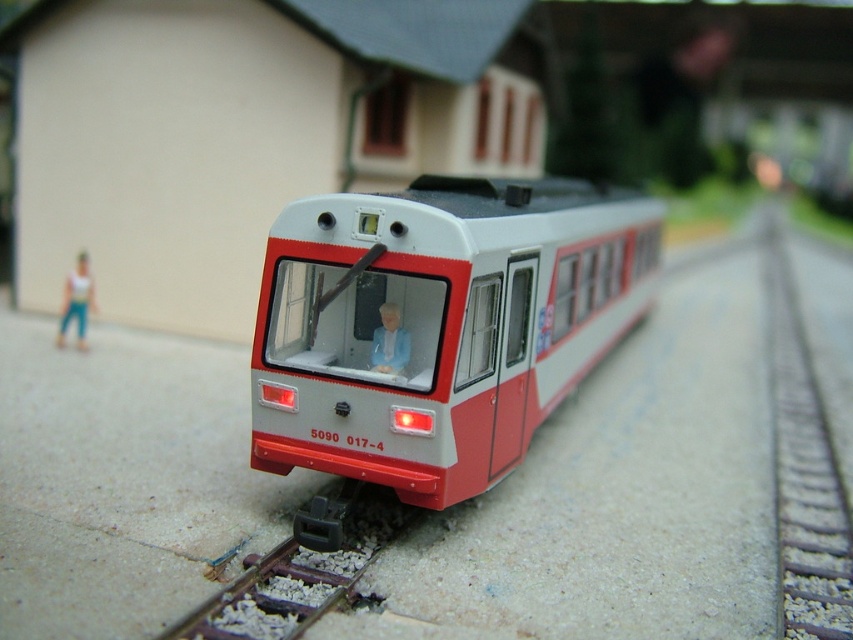
From the picture: Can you confirm if smooth metal train track at center is thinner than light blue fabric jacket at center?

No.

Does smooth metal train track at center appear under light blue fabric jacket at center?

Yes.

Locate an element on the screen. The width and height of the screenshot is (853, 640). smooth metal train track at center is located at coordinates (804, 468).

Where is `smooth metal train track at center`? smooth metal train track at center is located at coordinates (804, 468).

Who is higher up, metal/smooth track at lower center or white matte figure at left?

Positioned higher is white matte figure at left.

I want to click on metal/smooth track at lower center, so click(300, 566).

Who is more distant from viewer, (263, 602) or (67, 317)?

The point (67, 317) is more distant.

Where is `metal/smooth track at lower center`? This screenshot has width=853, height=640. metal/smooth track at lower center is located at coordinates (300, 566).

Who is higher up, smooth metal train track at center or white matte figure at left?

white matte figure at left

Does smooth metal train track at center have a lesser width compared to white matte figure at left?

No, smooth metal train track at center is not thinner than white matte figure at left.

Is point (834, 536) more distant than point (79, 285)?

No, it is in front of (79, 285).

Identify the location of smooth metal train track at center. (804, 468).